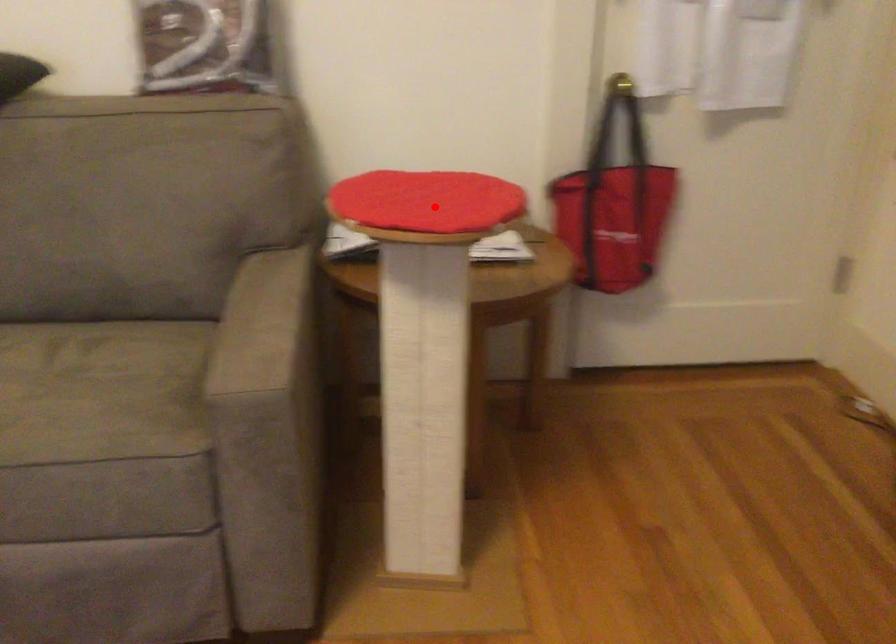
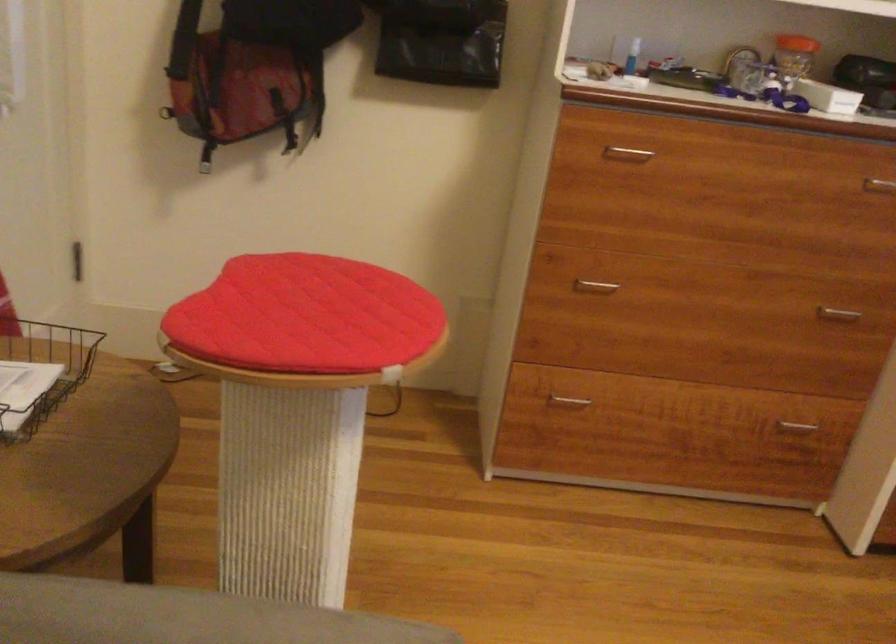
Question: I am providing you with two images of the same scene from different viewpoints. A red point is shown in image1. For the corresponding object point in image2, is it positioned nearer or farther from the camera?

Choices:
 (A) Nearer
 (B) Farther

Answer: (A)